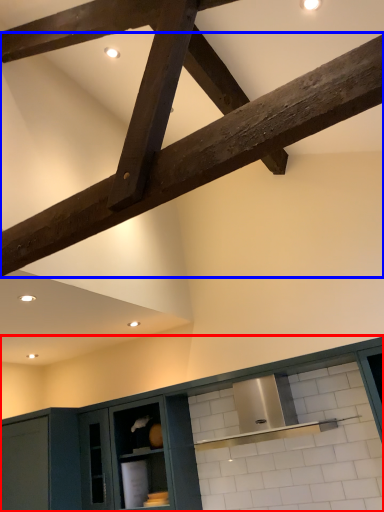
Question: Which object appears closest to the camera in this image, cabinetry (highlighted by a red box) or beam (highlighted by a blue box)?

Choices:
 (A) cabinetry
 (B) beam

Answer: (B)